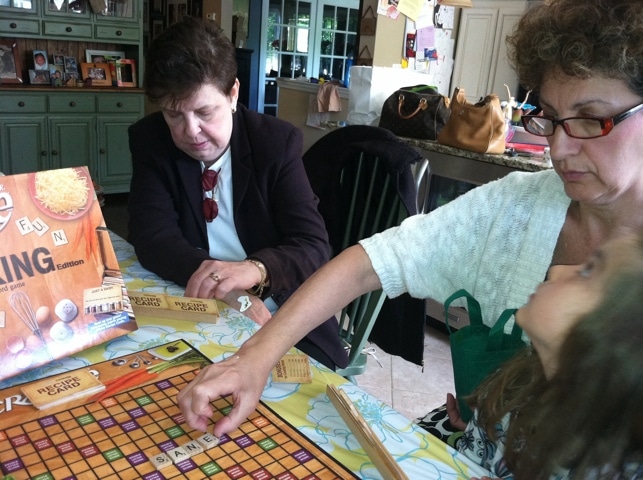
Locate an element on the screen. double patio door is located at coordinates (312, 54).